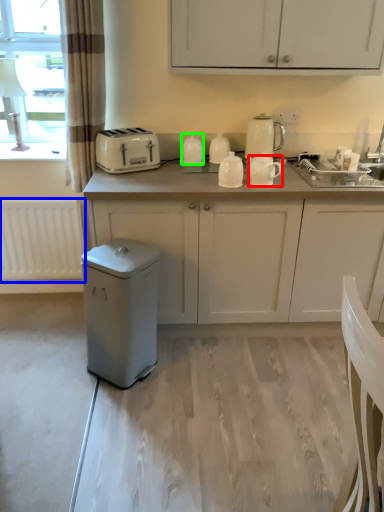
Question: Which is nearer to the kitchen appliance (highlighted by a red box)? radiator (highlighted by a blue box) or kitchen appliance (highlighted by a green box).

Choices:
 (A) radiator
 (B) kitchen appliance

Answer: (B)